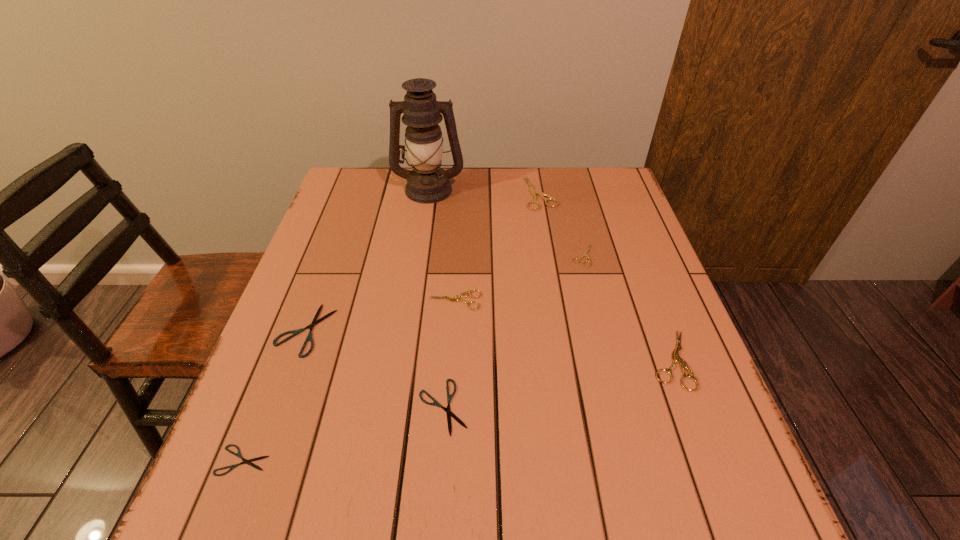
In order to click on the third nearest beige shears in this screenshot , I will do `click(585, 253)`.

I want to click on the rightmost black shears, so click(449, 397).

You are a GUI agent. You are given a task and a screenshot of the screen. Output one action in this format:
    pyautogui.click(x=<x>, y=<y>)
    Task: Click on the second farthest black shears
    The width and height of the screenshot is (960, 540).
    Given the screenshot: What is the action you would take?
    pyautogui.click(x=449, y=397)

Where is `the nearest shears`? The width and height of the screenshot is (960, 540). the nearest shears is located at coordinates (249, 462).

The image size is (960, 540). Identify the location of the nearest black shears. (249, 462).

I want to click on vacant point located 0.080m on the front of the blue oil lamp, so click(x=424, y=220).

Where is `vacant space situated 0.150m on the right of the third object from right to left`? This screenshot has width=960, height=540. vacant space situated 0.150m on the right of the third object from right to left is located at coordinates (605, 193).

At what (x,y) coordinates should I click in order to perform the action: click on vacant space located on the back of the second tallest shears. Please return your answer as a coordinate pair (x, y). The image size is (960, 540). Looking at the image, I should click on (637, 269).

Image resolution: width=960 pixels, height=540 pixels. Identify the location of free region located 0.160m on the left of the leftmost beige shears. (361, 300).

Image resolution: width=960 pixels, height=540 pixels. I want to click on free space located 0.190m on the front of the biggest black shears, so click(262, 447).